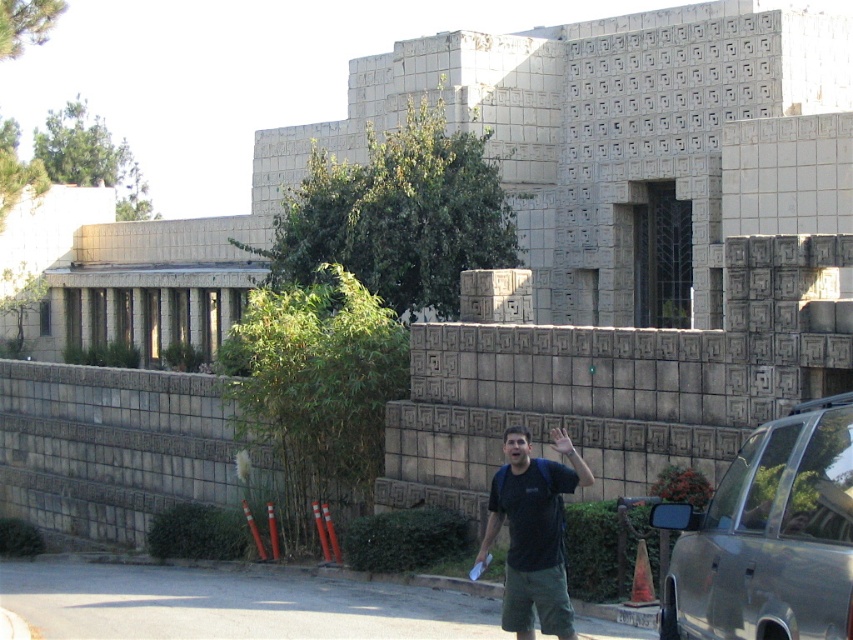
Who is more forward, (567, 481) or (560, 449)?

Positioned in front is point (560, 449).

Is black fabric shirt at center further to camera compared to matte black hand at center?

No, black fabric shirt at center is in front of matte black hand at center.

Who is more distant from viewer, (529, 568) or (549, 433)?

The point (549, 433) is behind.

The image size is (853, 640). I want to click on black fabric shirt at center, so pos(532,536).

Is silver metallic car at lower right below black fabric shirt at center?

Incorrect, silver metallic car at lower right is not positioned below black fabric shirt at center.

Between point (699, 513) and point (566, 614), which one is positioned in front?

Point (699, 513) is more forward.

Which is in front, point (769, 518) or point (491, 544)?

Point (769, 518)

At what (x,y) coordinates should I click in order to perform the action: click on silver metallic car at lower right. Please return your answer as a coordinate pair (x, y). Looking at the image, I should click on coord(769,536).

Between silver metallic car at lower right and matte black hand at center, which one appears on the right side from the viewer's perspective?

silver metallic car at lower right is more to the right.

Is silver metallic car at lower right above matte black hand at center?

Yes, silver metallic car at lower right is above matte black hand at center.

I want to click on silver metallic car at lower right, so click(x=769, y=536).